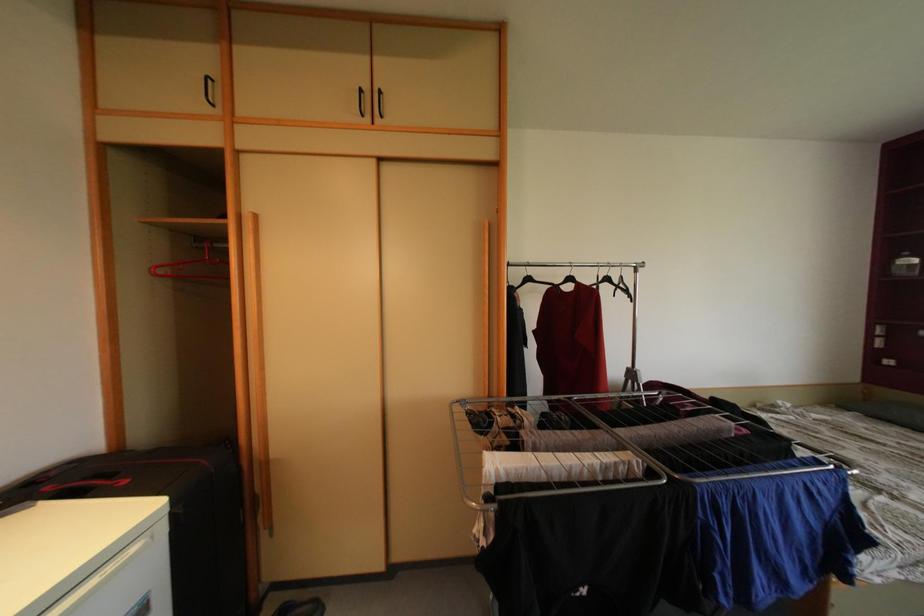
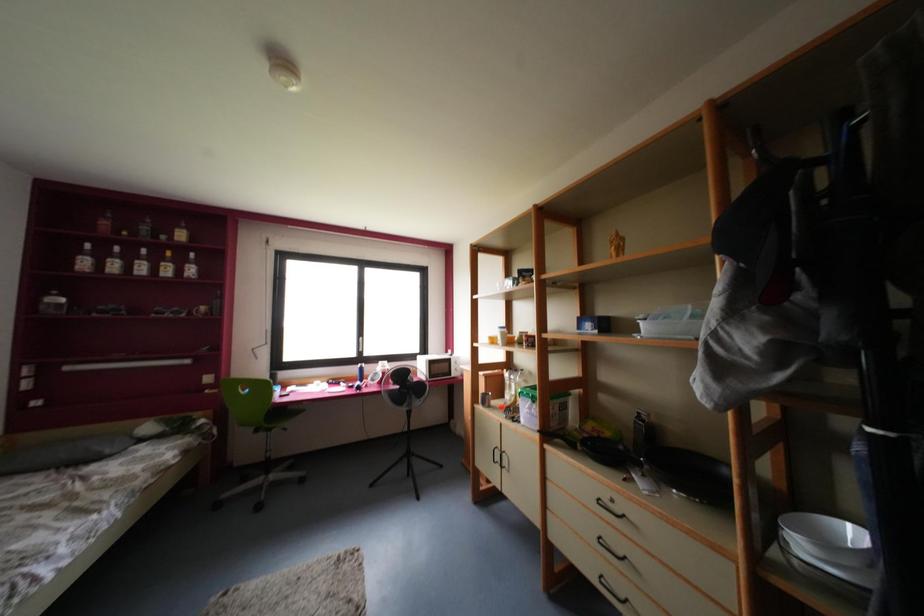
Question: The camera is either moving clockwise (left) or counter-clockwise (right) around the object. The first image is from the beginning of the video and the second image is from the end. Is the camera moving left or right when shooting the video?

Choices:
 (A) Left
 (B) Right

Answer: (A)